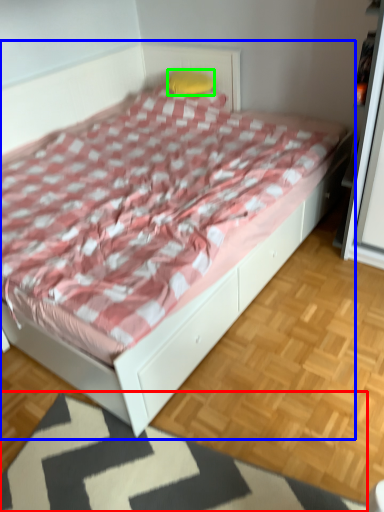
Question: Which object is positioned farthest from mat (highlighted by a red box)? Select from bed (highlighted by a blue box) and pillow (highlighted by a green box).

Choices:
 (A) bed
 (B) pillow

Answer: (B)